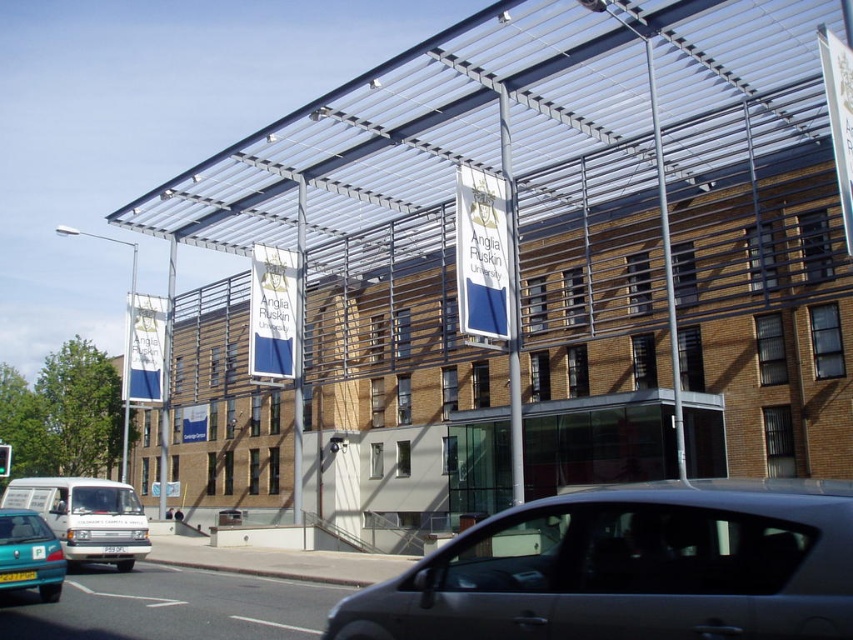
Question: Can you confirm if white matte van at lower left is wider than teal matte hatchback at lower left?

Choices:
 (A) yes
 (B) no

Answer: (A)

Question: Does silver metallic car at center appear over teal matte hatchback at lower left?

Choices:
 (A) yes
 (B) no

Answer: (A)

Question: Does white matte van at lower left have a greater width compared to teal matte hatchback at lower left?

Choices:
 (A) yes
 (B) no

Answer: (A)

Question: Which object appears farthest from the camera in this image?

Choices:
 (A) silver metallic car at center
 (B) teal matte hatchback at lower left

Answer: (B)

Question: Which of the following is the farthest from the observer?

Choices:
 (A) (422, 600)
 (B) (56, 490)
 (C) (10, 557)

Answer: (B)

Question: Estimate the real-world distances between objects in this image. Which object is farther from the teal matte hatchback at lower left?

Choices:
 (A) silver metallic car at center
 (B) white matte van at lower left

Answer: (A)